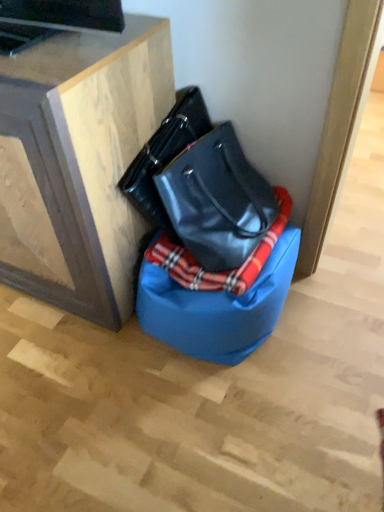
Find the location of a particular element. Image resolution: width=384 pixels, height=512 pixels. vacant position to the left of blue fabric bean bag chair at lower center is located at coordinates (89, 365).